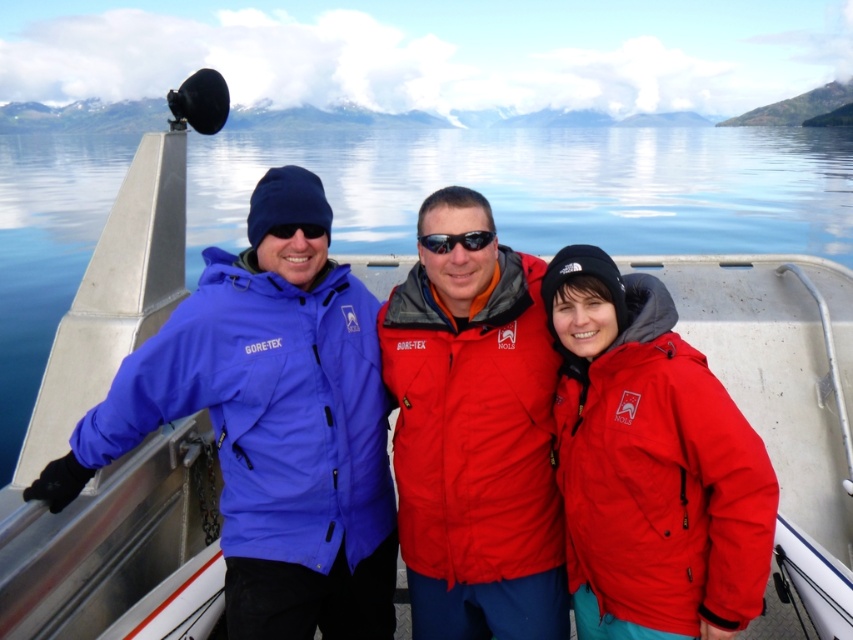
Question: Which point appears farthest from the camera in this image?

Choices:
 (A) (234, 374)
 (B) (424, 244)

Answer: (B)

Question: Where is matte red jacket at center located in relation to matte black goggles at center in the image?

Choices:
 (A) right
 (B) left

Answer: (A)

Question: Does matte blue jacket at left appear over red matte jacket at center?

Choices:
 (A) no
 (B) yes

Answer: (B)

Question: Can you confirm if matte red jacket at center is positioned below matte black goggles at center?

Choices:
 (A) yes
 (B) no

Answer: (A)

Question: Which object is positioned farthest from the matte black goggles at center?

Choices:
 (A) red matte jacket at center
 (B) matte red jacket at center

Answer: (A)

Question: Which object is closer to the camera taking this photo?

Choices:
 (A) red matte jacket at center
 (B) black reflective sunglasses at center
 (C) matte red jacket at center
 (D) matte blue jacket at left

Answer: (A)